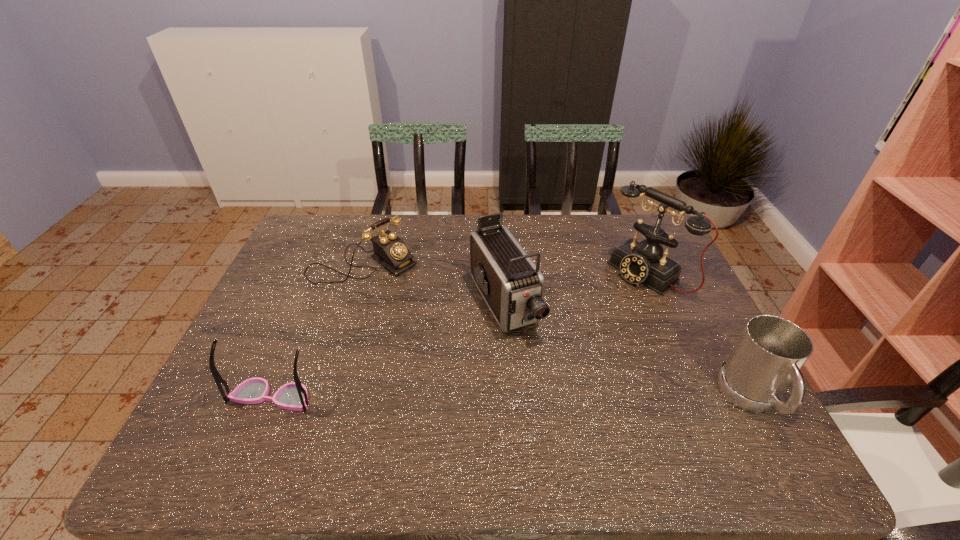
Locate an element on the screen. spectacles is located at coordinates (293, 396).

Where is `mug`? The height and width of the screenshot is (540, 960). mug is located at coordinates (770, 352).

You are a GUI agent. You are given a task and a screenshot of the screen. Output one action in this format:
    pyautogui.click(x=<x>, y=<y>)
    Task: Click on the left telephone
    The image size is (960, 540).
    Given the screenshot: What is the action you would take?
    pyautogui.click(x=390, y=251)

Identify the location of camcorder. The width and height of the screenshot is (960, 540). (512, 286).

The height and width of the screenshot is (540, 960). Find the location of `the right telephone`. the right telephone is located at coordinates (643, 262).

I want to click on vacant space located on the back of the spectacles, so click(309, 307).

This screenshot has height=540, width=960. Identify the location of free point located 0.280m on the dial of the left telephone. (462, 328).

Identify the location of vacant space located on the dial of the left telephone. This screenshot has height=540, width=960. (413, 290).

Locate an element on the screen. The image size is (960, 540). vacant space located 0.180m on the dial of the left telephone is located at coordinates (437, 309).

At what (x,y) coordinates should I click in order to perform the action: click on free region located 0.110m at the lens of the third object from right to left. Please return your answer as a coordinate pair (x, y). This screenshot has width=960, height=540. Looking at the image, I should click on (540, 374).